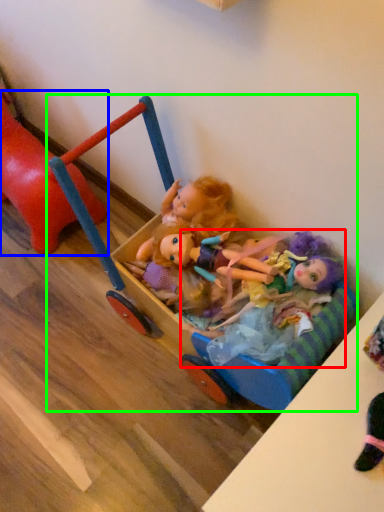
Question: Considering the real-world distances, which object is farthest from doll (highlighted by a red box)? toy (highlighted by a blue box) or toy (highlighted by a green box)?

Choices:
 (A) toy
 (B) toy

Answer: (A)